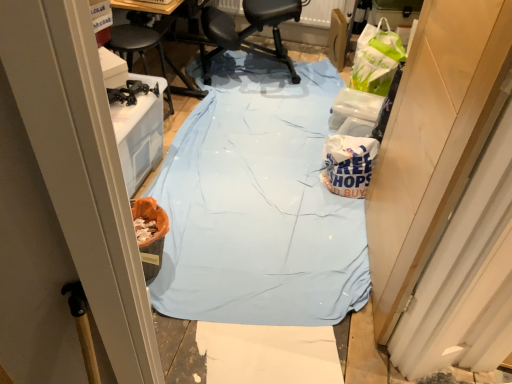
Question: From a real-world perspective, relative to wooden door at right, is white paper bag at center-right vertically above or below?

Choices:
 (A) above
 (B) below

Answer: (B)

Question: Visually, is white paper bag at center-right positioned to the left or to the right of wooden door at right?

Choices:
 (A) right
 (B) left

Answer: (B)

Question: Which object is the closest to the black leather chair at center?

Choices:
 (A) wooden door at right
 (B) light blue fabric at center
 (C) white paper bag at center-right

Answer: (B)

Question: Which object is positioned farthest from the black leather chair at center?

Choices:
 (A) wooden door at right
 (B) white paper bag at center-right
 (C) light blue fabric at center

Answer: (A)